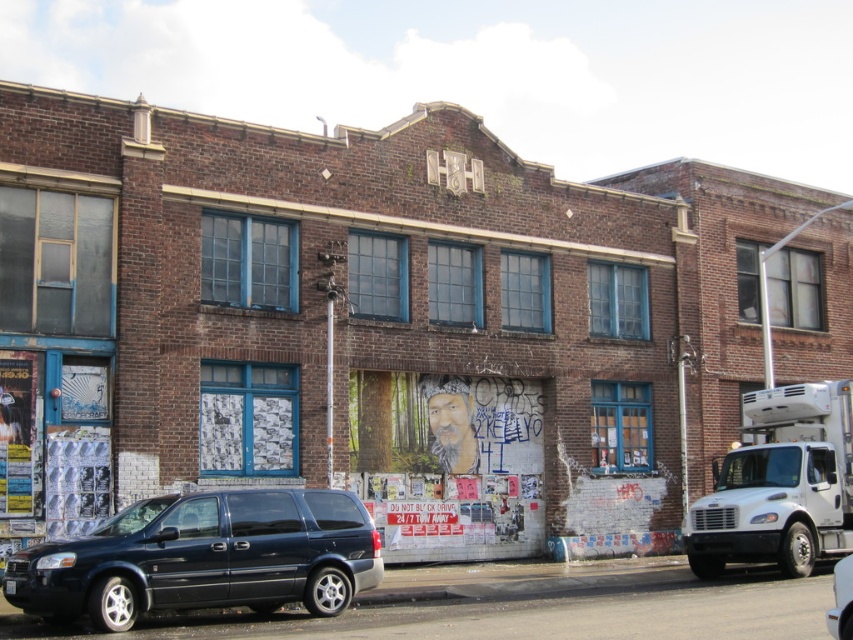
Is matte black minivan at lower left smaller than white metallic truck at right?

Actually, matte black minivan at lower left might be larger than white metallic truck at right.

Who is positioned more to the right, matte black minivan at lower left or white metallic truck at right?

white metallic truck at right is more to the right.

Is point (370, 573) positioned before point (770, 508)?

That is True.

Where is `matte black minivan at lower left`? This screenshot has width=853, height=640. matte black minivan at lower left is located at coordinates (202, 557).

Between matte black minivan at lower left and matte black van at center, which one appears on the left side from the viewer's perspective?

matte black minivan at lower left

Who is more forward, (56, 589) or (843, 634)?

Point (843, 634) is more forward.

Measure the distance between point (341, 550) and camera.

A distance of 16.47 meters exists between point (341, 550) and camera.

Image resolution: width=853 pixels, height=640 pixels. I want to click on matte black minivan at lower left, so click(x=202, y=557).

Who is shorter, white metallic truck at right or matte black van at center?

white metallic truck at right

Does white metallic truck at right appear on the right side of matte black van at center?

Yes, white metallic truck at right is to the right of matte black van at center.

Who is more forward, [842,404] or [840,609]?

Point [840,609] is more forward.

Find the location of a particular element. Image resolution: width=853 pixels, height=640 pixels. white metallic truck at right is located at coordinates (780, 484).